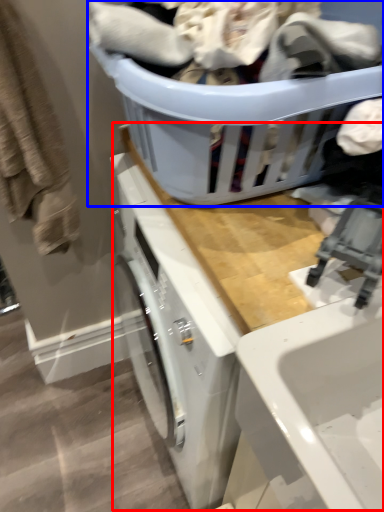
Question: Among these objects, which one is nearest to the camera, counter top (highlighted by a red box) or basket (highlighted by a blue box)?

Choices:
 (A) counter top
 (B) basket

Answer: (B)